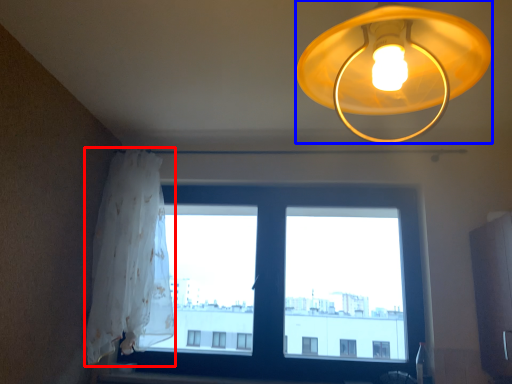
Question: Which object is closer to the camera taking this photo, curtain (highlighted by a red box) or lamp (highlighted by a blue box)?

Choices:
 (A) curtain
 (B) lamp

Answer: (B)